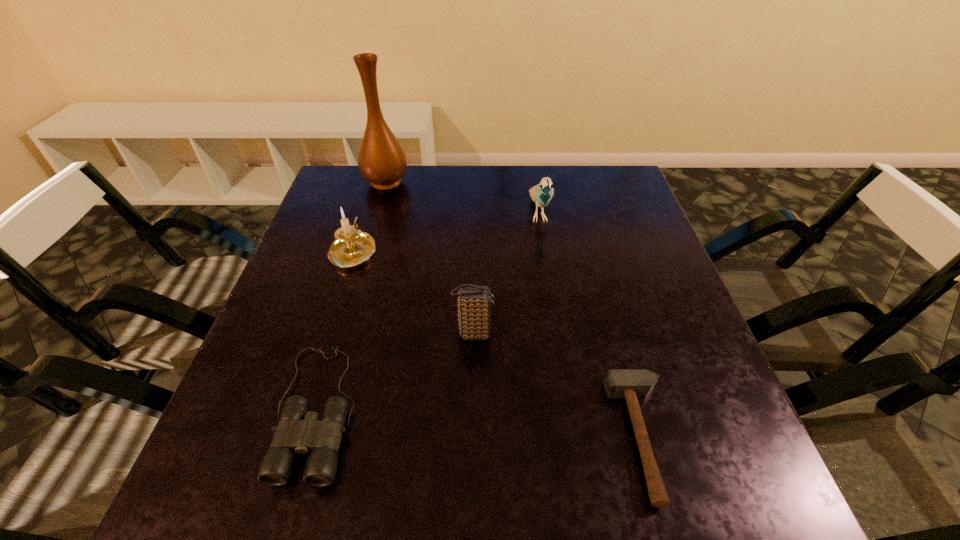
The image size is (960, 540). I want to click on vase, so click(382, 161).

Locate an element on the screen. Image resolution: width=960 pixels, height=540 pixels. the fifth object from left to right is located at coordinates (541, 194).

Find the location of `candle holder`. candle holder is located at coordinates (352, 247).

Where is `the fourth farthest object`? The height and width of the screenshot is (540, 960). the fourth farthest object is located at coordinates (474, 302).

I want to click on clutch bag, so click(474, 302).

Locate an element on the screen. Image resolution: width=960 pixels, height=540 pixels. binoculars is located at coordinates (298, 431).

Identify the location of the rightmost object. This screenshot has width=960, height=540. (630, 384).

Where is `hammer`? hammer is located at coordinates (630, 384).

The image size is (960, 540). Identify the location of free space located 0.090m on the front of the vase. (376, 212).

I want to click on vacant space located at the face of the bird, so click(x=557, y=328).